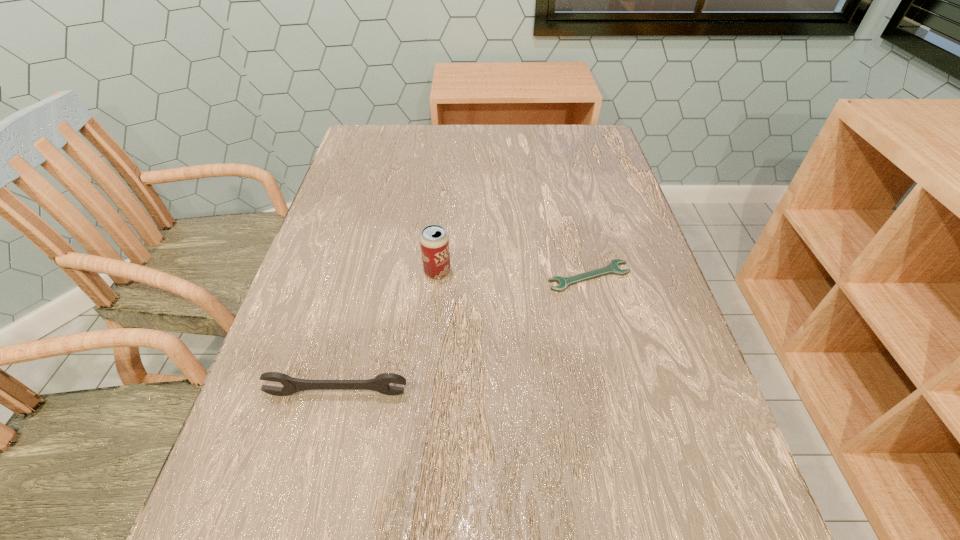
Identify the location of the tallest object. Image resolution: width=960 pixels, height=540 pixels. (434, 241).

Image resolution: width=960 pixels, height=540 pixels. Find the location of `the second object from left to right`. the second object from left to right is located at coordinates (434, 241).

Where is `the left wrench`? the left wrench is located at coordinates (380, 383).

Locate an element on the screen. the nearest object is located at coordinates (380, 383).

Identify the location of the farther wrench. This screenshot has width=960, height=540. (612, 268).

Image resolution: width=960 pixels, height=540 pixels. Find the location of `the right wrench`. the right wrench is located at coordinates click(612, 268).

Where is `free space located on the left of the tallest object`? This screenshot has height=540, width=960. free space located on the left of the tallest object is located at coordinates (365, 272).

Find the location of a particular element. vacant space located 0.110m on the open ends of the nearest object is located at coordinates (321, 461).

The width and height of the screenshot is (960, 540). I want to click on free space located on the left of the right wrench, so click(432, 276).

The image size is (960, 540). In order to click on object at the left edge in this screenshot , I will do `click(380, 383)`.